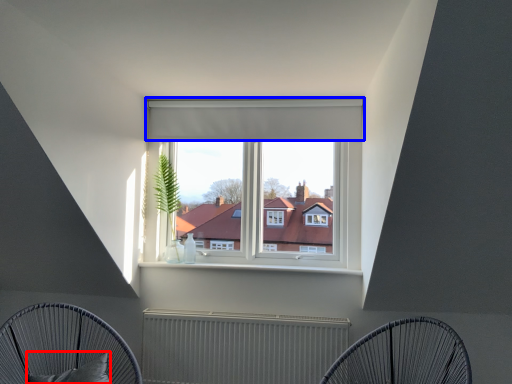
Question: Which object appears closest to the camera in this image, pillow (highlighted by a red box) or curtain (highlighted by a blue box)?

Choices:
 (A) pillow
 (B) curtain

Answer: (A)